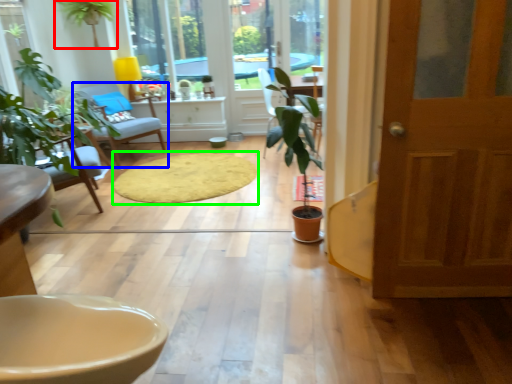
Question: Which object is positioned farthest from houseplant (highlighted by a red box)? Select from chair (highlighted by a blue box) and mat (highlighted by a green box).

Choices:
 (A) chair
 (B) mat

Answer: (B)